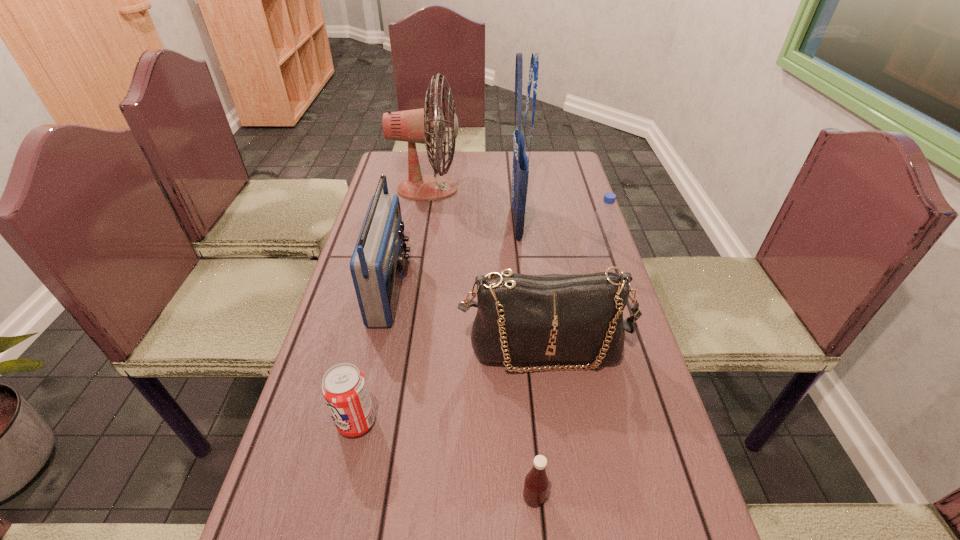
Find the location of a particular element. This screenshot has width=960, height=540. free space between the Tabasco sauce and the handbag is located at coordinates (539, 423).

Where is `blank region between the tallest object and the second tallest object`? This screenshot has height=540, width=960. blank region between the tallest object and the second tallest object is located at coordinates (472, 206).

At what (x,y) coordinates should I click in order to perform the action: click on empty space that is in between the bottle and the Tabasco sauce. Please return your answer as a coordinate pair (x, y). The height and width of the screenshot is (540, 960). Looking at the image, I should click on click(x=564, y=379).

Where is `empty location between the bottle and the sixth shortest object`? empty location between the bottle and the sixth shortest object is located at coordinates (512, 225).

Select which object appears as the second closest to the fan. Please provide its 2D coordinates. Your answer should be formatted as a tuple, i.e. [(x, y)], where the tuple contains the x and y coordinates of a point satisfying the conditions above.

[(377, 263)]

Image resolution: width=960 pixels, height=540 pixels. I want to click on object that stands as the closest to the nearest object, so click(521, 318).

Locate an element on the screen. The width and height of the screenshot is (960, 540). free spot that satisfies the following two spatial constraints: 1. in front of the fan to direct airflow; 2. on the back side of the bottle is located at coordinates (416, 260).

Where is `vacant space that satisfies the following two spatial constraints: 1. on the front panel of the radio receiver; 2. on the right side of the Tabasco sauce`? The width and height of the screenshot is (960, 540). vacant space that satisfies the following two spatial constraints: 1. on the front panel of the radio receiver; 2. on the right side of the Tabasco sauce is located at coordinates (345, 497).

The image size is (960, 540). What are the coordinates of `free location that satisfies the following two spatial constraints: 1. on the back side of the bottle; 2. on the left side of the soda can` in the screenshot? It's located at (394, 260).

At what (x,y) coordinates should I click in order to perform the action: click on free location that satisfies the following two spatial constraints: 1. on the back side of the bottle; 2. in front of the sixth shortest object to direct airflow. Please return your answer as a coordinate pair (x, y). This screenshot has height=540, width=960. Looking at the image, I should click on (575, 190).